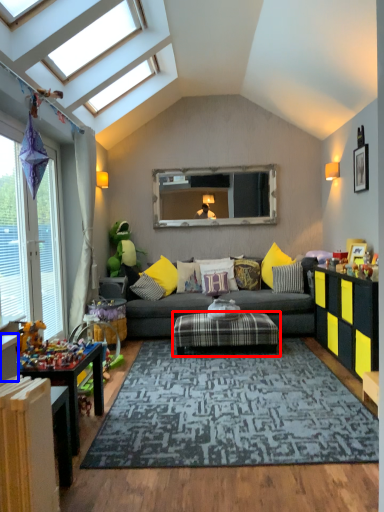
Question: Which object is further to the camera taking this photo, coffee table (highlighted by a red box) or table (highlighted by a blue box)?

Choices:
 (A) coffee table
 (B) table

Answer: (A)